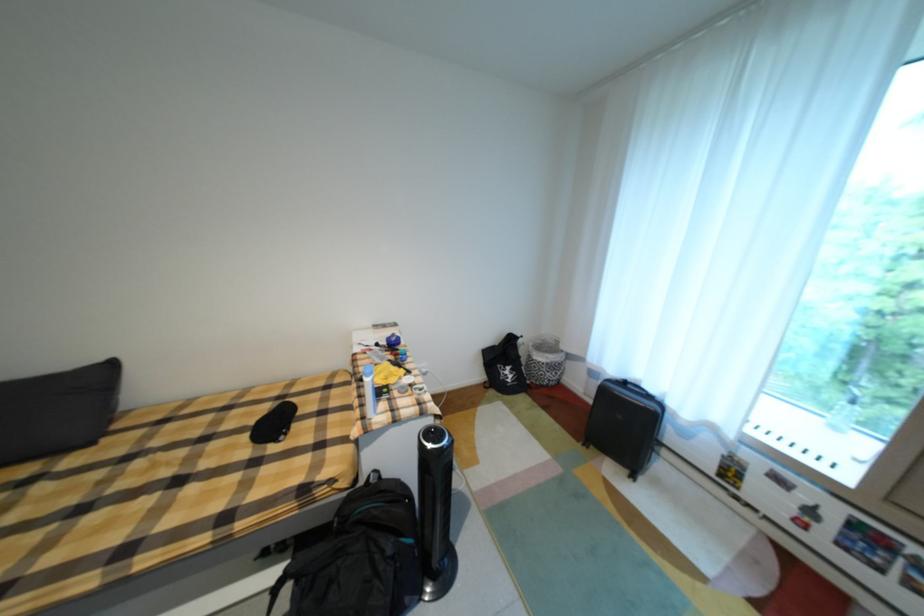
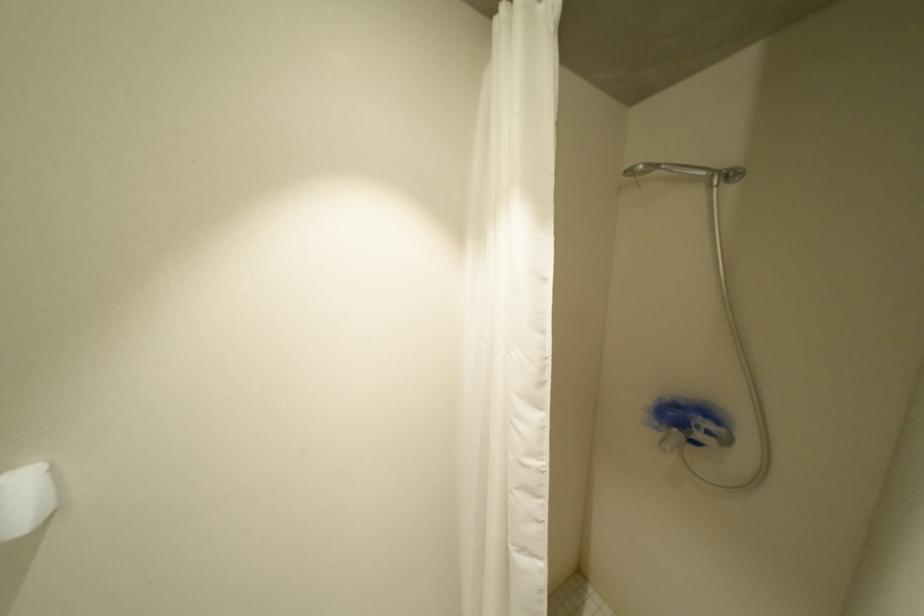
Question: Which direction would the cameraman need to move to produce the second image? Reply with the corresponding letter.

Choices:
 (A) Left
 (B) Right
 (C) Forward
 (D) Backward

Answer: (A)